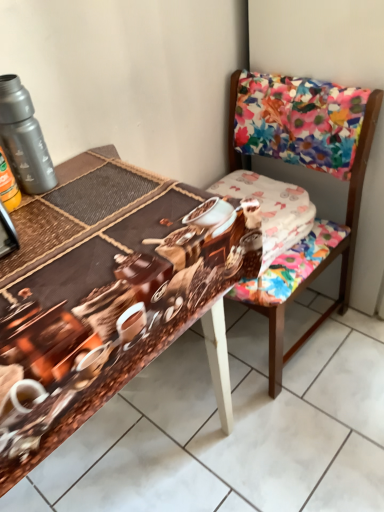
Identify the location of vacant space in front of metallic gray thermos at upper left. This screenshot has width=384, height=512. (54, 220).